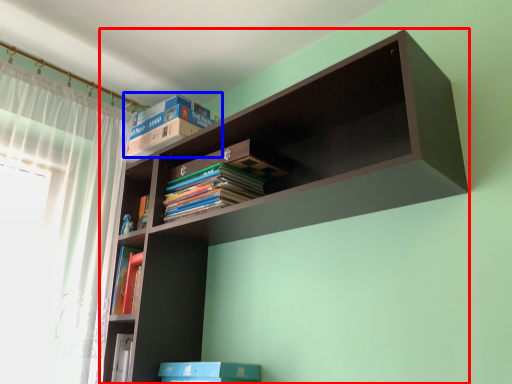
Question: Among these objects, which one is farthest to the camera, shelf (highlighted by a red box) or book (highlighted by a blue box)?

Choices:
 (A) shelf
 (B) book

Answer: (B)